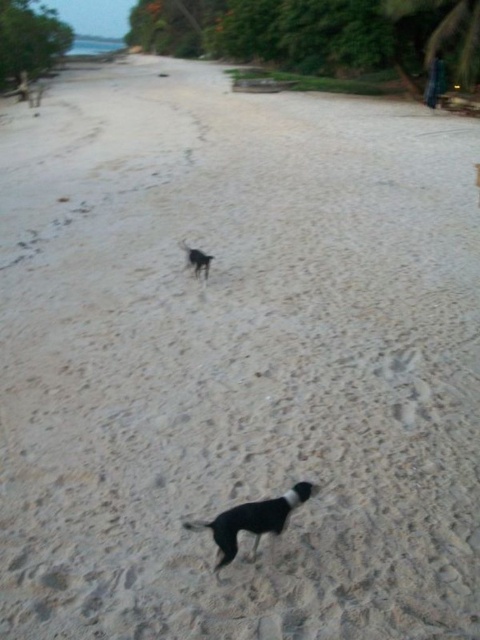
Does black fur dog at center have a lesser width compared to black matte dog at center?

Incorrect, black fur dog at center's width is not less than black matte dog at center's.

Between black fur dog at center and black matte dog at center, which one is positioned higher?

Positioned higher is black matte dog at center.

Does point (275, 500) lie behind point (196, 257)?

No, it is in front of (196, 257).

Locate an element on the screen. This screenshot has width=480, height=640. black fur dog at center is located at coordinates click(252, 520).